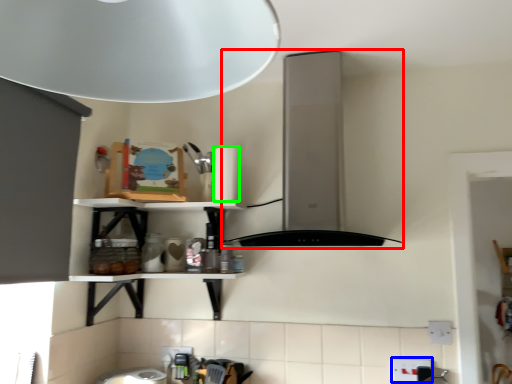
Question: Based on their relative distances, which object is farther from vent (highlighted by a red box)? Choose from electric outlet (highlighted by a blue box) and paper towel (highlighted by a green box).

Choices:
 (A) electric outlet
 (B) paper towel

Answer: (A)